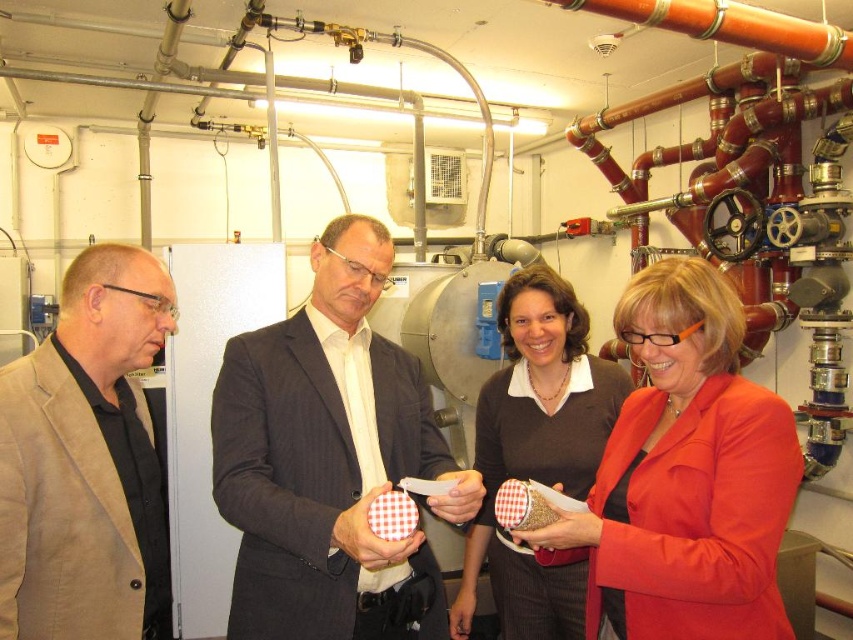
You are an observer in the room. You notice two clothing items worn by the individuals in the scene. The beige fabric jacket at left and the matte brown sweater at center. Which clothing item is positioned higher up in the image?

The beige fabric jacket at left is located above the matte brown sweater at center, so it is positioned higher up in the image.

You are a photographer trying to capture a clear shot of the dark gray pinstripe suit at center and the beige fabric jacket at left. Since you want both subjects to be in focus, you need to adjust your camera settings. Which subject should you focus on to ensure both are sharp?

You should focus on the beige fabric jacket at left because it is farther away from the camera than the dark gray pinstripe suit at center. By focusing on the farther subject, the near subject will also be in focus due to the depth of field.

You are standing in the utility room and need to reach a control panel located at point (511, 300). There is an obstacle at point (120, 608). Can you navigate around it to reach the control panel?

Yes, you can navigate around the obstacle at point (120, 608) to reach the control panel at point (511, 300) since the obstacle is in front of the control panel, indicating they are along the same path. You can go around it by moving to the side.